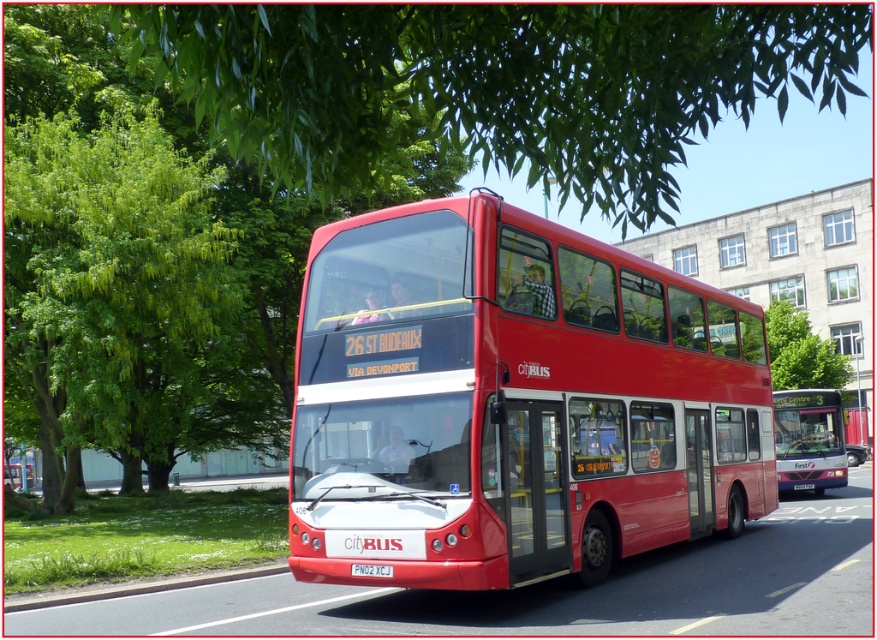
Based on the photo, you are standing at the back of the red double decker bus and want to walk to the front of the bus. Which point, point (x=101, y=124) or point (x=93, y=595), is closer to the front of the bus?

Point (x=93, y=595) is closer to the front of the red double decker bus because it is in front of point (x=101, y=124).

You are a photographer standing at the camera position. You want to take a photo of the red double decker bus but also include the green leafy tree at upper left in the frame. The camera has a maximum zoom range of 100 feet. Can you capture both the bus and the tree in the same photo without moving the camera?

The green leafy tree at upper left is 46.05 feet from the camera, which is within the camera maximum zoom range of 100 feet. Therefore, you can capture both the red double decker bus and the tree in the same photo without moving the camera.